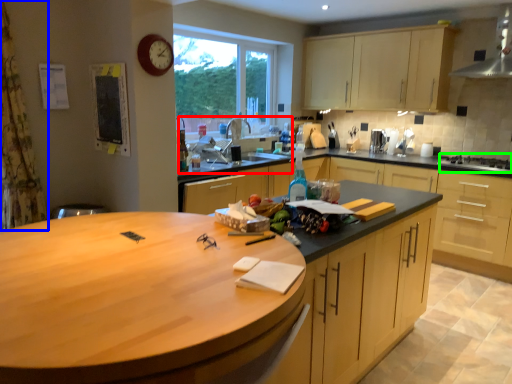
Question: Which is farther away from sink (highlighted by a red box)? curtain (highlighted by a blue box) or gas stove (highlighted by a green box)?

Choices:
 (A) curtain
 (B) gas stove

Answer: (B)